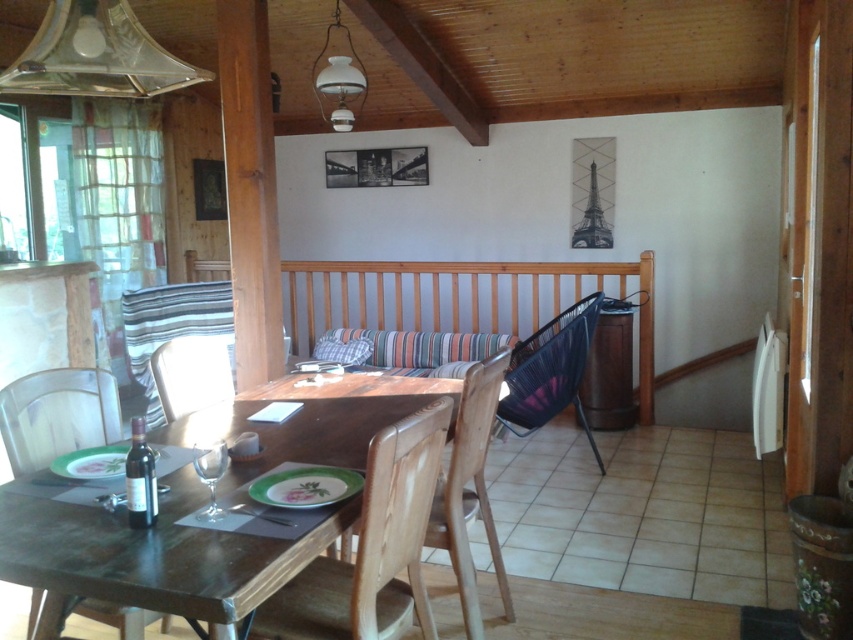
Based on the photo, who is positioned more to the left, wooden pillar at center or white fabric chair at center?

From the viewer's perspective, white fabric chair at center appears more on the left side.

Where is `wooden pillar at center`? Image resolution: width=853 pixels, height=640 pixels. wooden pillar at center is located at coordinates (250, 189).

Locate an element on the screen. This screenshot has width=853, height=640. wooden pillar at center is located at coordinates (250, 189).

You are a GUI agent. You are given a task and a screenshot of the screen. Output one action in this format:
    pyautogui.click(x=<x>, y=<y>)
    Task: Click on the wooden table at center
    Image resolution: width=853 pixels, height=640 pixels.
    Given the screenshot: What is the action you would take?
    pyautogui.click(x=152, y=554)

Does wooden table at center have a greater height compared to wooden pillar at center?

Incorrect, wooden table at center's height is not larger of wooden pillar at center's.

Who is more forward, (248, 604) or (277, 355)?

Point (248, 604)

Find the location of `wooden table at center`. wooden table at center is located at coordinates (152, 554).

Can you confirm if wooden table at center is bigger than light brown wood chair at center?

Indeed, wooden table at center has a larger size compared to light brown wood chair at center.

Between wooden table at center and light brown wood chair at center, which one appears on the right side from the viewer's perspective?

light brown wood chair at center

Between point (160, 596) and point (463, 525), which one is positioned in front?

Point (160, 596) is in front.

This screenshot has height=640, width=853. I want to click on wooden table at center, so click(152, 554).